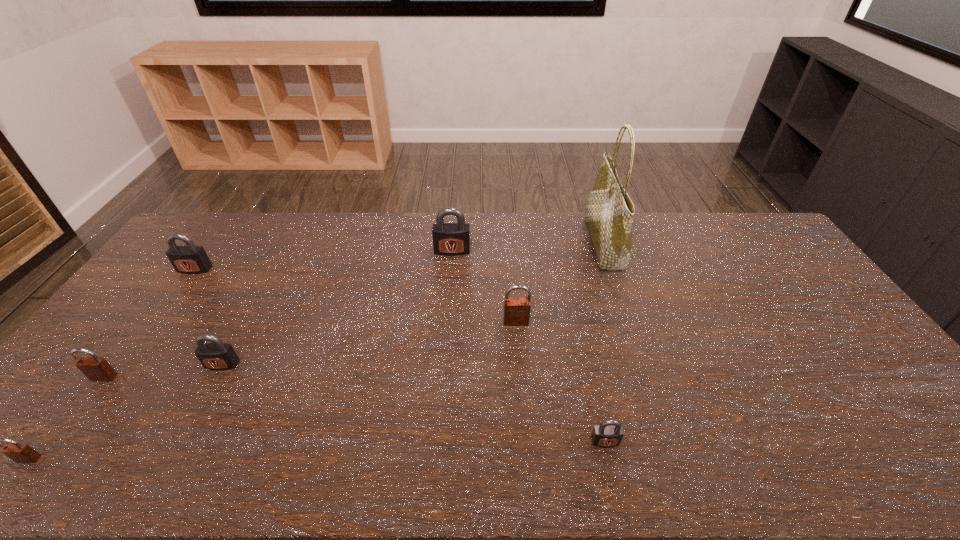
Find the location of a particular element. The image size is (960, 540). vacant space that is in between the second object from right to left and the second smallest brown padlock is located at coordinates (354, 409).

At what (x,y) coordinates should I click in order to perform the action: click on unoccupied position between the third gray padlock from left to right and the nearest object. Please return your answer as a coordinate pair (x, y). The height and width of the screenshot is (540, 960). Looking at the image, I should click on (241, 355).

Image resolution: width=960 pixels, height=540 pixels. Find the location of `free area in between the second biggest brown padlock and the fifth nearest object`. free area in between the second biggest brown padlock and the fifth nearest object is located at coordinates (310, 350).

The height and width of the screenshot is (540, 960). Identify the location of unoccupied area between the biggest brown padlock and the third nearest object. (310, 350).

I want to click on free space between the third gray padlock from left to right and the green shopping bag, so click(x=527, y=247).

At what (x,y) coordinates should I click in order to perform the action: click on free space between the smallest gray padlock and the third nearest padlock. Please return your answer as a coordinate pair (x, y). Image resolution: width=960 pixels, height=540 pixels. Looking at the image, I should click on (354, 409).

This screenshot has width=960, height=540. Identify the location of vacant region between the second farthest padlock and the second farthest brown padlock. (150, 323).

Where is `free space between the nearest brown padlock and the farthest gray padlock`? The height and width of the screenshot is (540, 960). free space between the nearest brown padlock and the farthest gray padlock is located at coordinates (241, 355).

Where is `free space that is in between the rightmost object and the second nearest brown padlock`? free space that is in between the rightmost object and the second nearest brown padlock is located at coordinates (353, 310).

Select which object is the fifth closest to the tallest object. Please provide its 2D coordinates. Your answer should be formatted as a tuple, i.e. [(x, y)], where the tuple contains the x and y coordinates of a point satisfying the conditions above.

[(187, 259)]